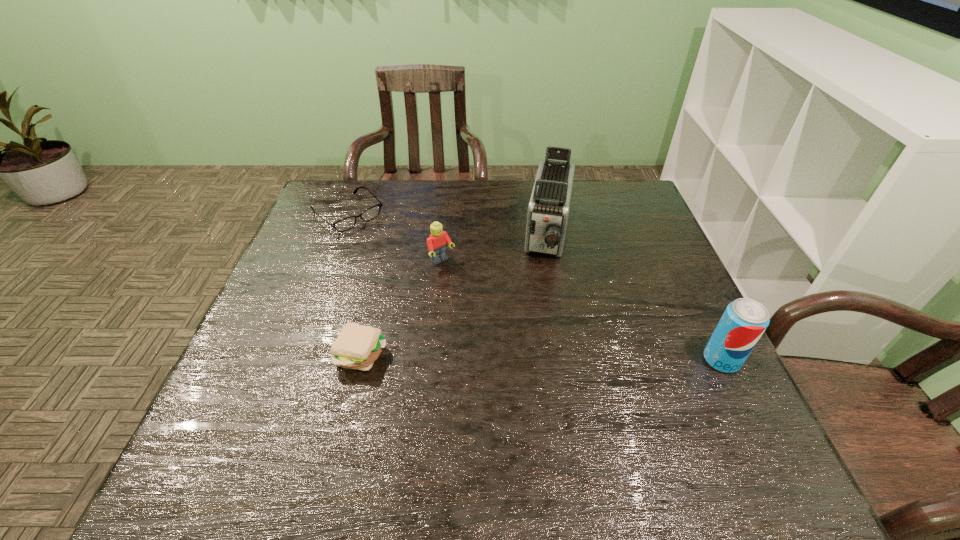
Where is `free space that is in between the soda can and the tallest object`? This screenshot has width=960, height=540. free space that is in between the soda can and the tallest object is located at coordinates (635, 298).

You are a GUI agent. You are given a task and a screenshot of the screen. Output one action in this format:
    pyautogui.click(x=<x>, y=<y>)
    Task: Click on the object that ranks as the third closest to the shortest object
    The height and width of the screenshot is (540, 960).
    Given the screenshot: What is the action you would take?
    pyautogui.click(x=548, y=210)

Locate an element on the screen. Image resolution: width=960 pixels, height=540 pixels. object identified as the third closest to the patty is located at coordinates (548, 210).

Identify the location of vacant point that satisfies the following two spatial constraints: 1. on the front side of the second tallest object; 2. on the left side of the third shortest object. This screenshot has height=540, width=960. (433, 360).

At what (x,y) coordinates should I click in order to perform the action: click on vacant space that satisfies the following two spatial constraints: 1. on the back side of the third object from left to right; 2. on the left side of the camcorder. Please return your answer as a coordinate pair (x, y). Looking at the image, I should click on (444, 235).